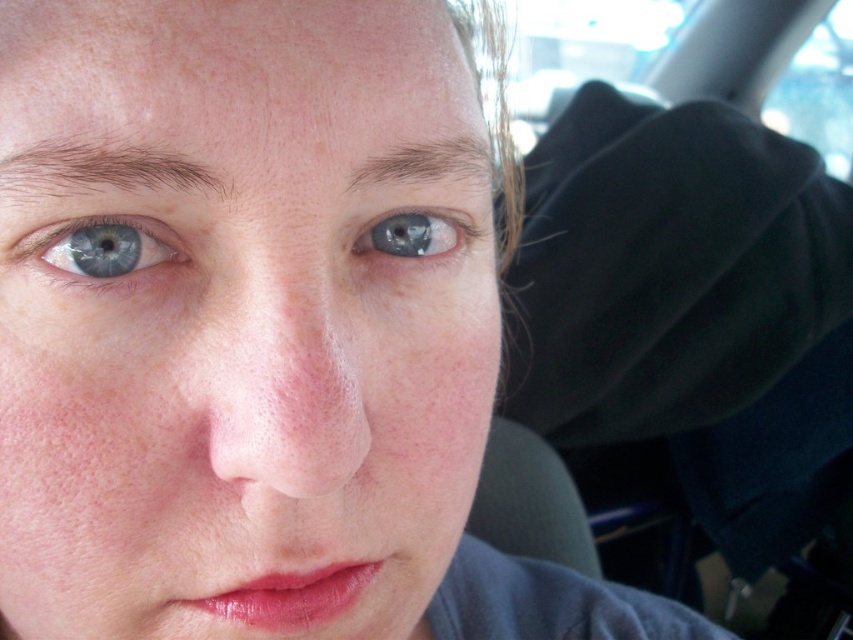
Question: Observing the image, what is the correct spatial positioning of smooth skin face at center in reference to blue glossy eye at upper center?

Choices:
 (A) below
 (B) above

Answer: (A)

Question: Does blue matte eye at left have a greater width compared to blue glossy eye at upper center?

Choices:
 (A) yes
 (B) no

Answer: (A)

Question: Which object is closer to the camera taking this photo?

Choices:
 (A) blue glossy eye at upper center
 (B) smooth skin face at center
 (C) blue matte eye at left

Answer: (B)

Question: Is smooth skin face at center behind blue matte eye at left?

Choices:
 (A) yes
 (B) no

Answer: (B)

Question: Which object is farther from the camera taking this photo?

Choices:
 (A) smooth skin face at center
 (B) blue matte eye at left

Answer: (B)

Question: Among these points, which one is farthest from the camera?

Choices:
 (A) (236, 529)
 (B) (65, 260)

Answer: (A)